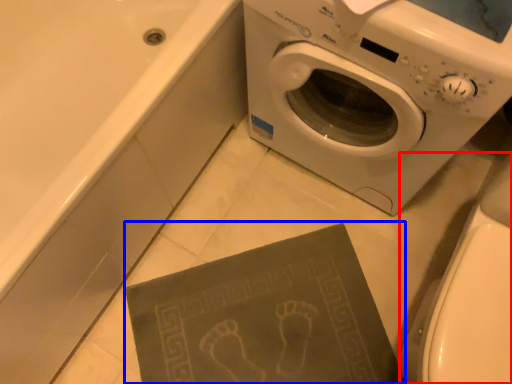
Question: Which object is closer to the camera taking this photo, toilet bowl (highlighted by a red box) or paperback book (highlighted by a blue box)?

Choices:
 (A) toilet bowl
 (B) paperback book

Answer: (A)